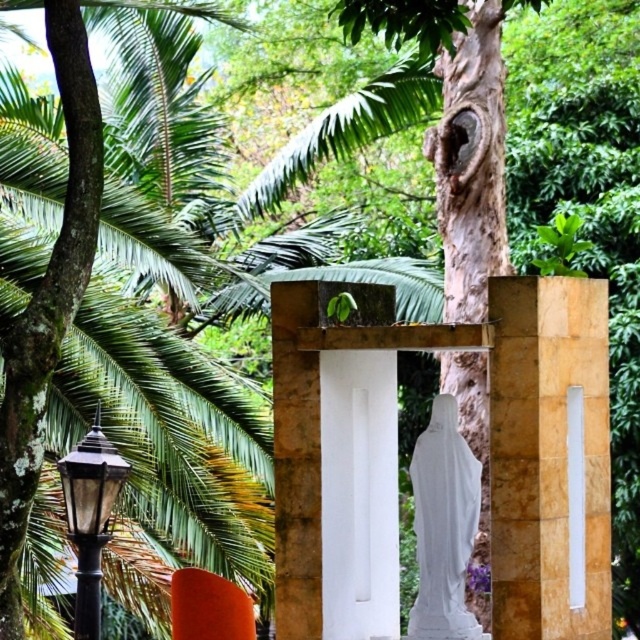
You are standing at the point with coordinates [444,525] in the image. What object are you standing on?

The point at coordinates [444,525] corresponds to the white marble statue at center.

You are standing in front of the stone structure and want to take a photo of both the white marble statue at center and the black glass lamp post at left. Which object should you focus on first to ensure both are in frame?

You should focus on the white marble statue at center first since it is closer to you than the black glass lamp post at left, ensuring both are within the camera frame.

Based on the scene description, where is the white marble statue at center located in terms of its 2D coordinates?

A: The white marble statue at center is located at the 2D coordinates of point (444, 525).